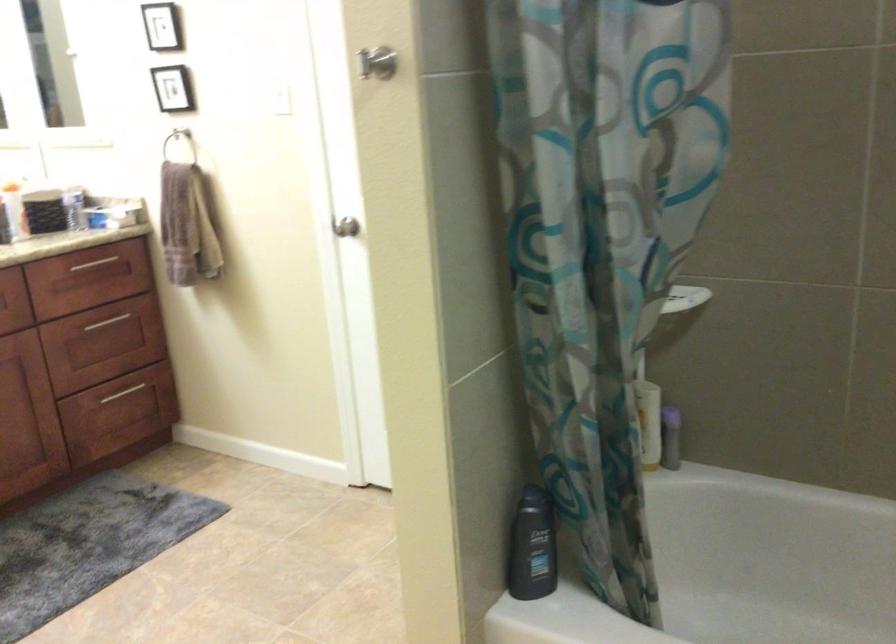
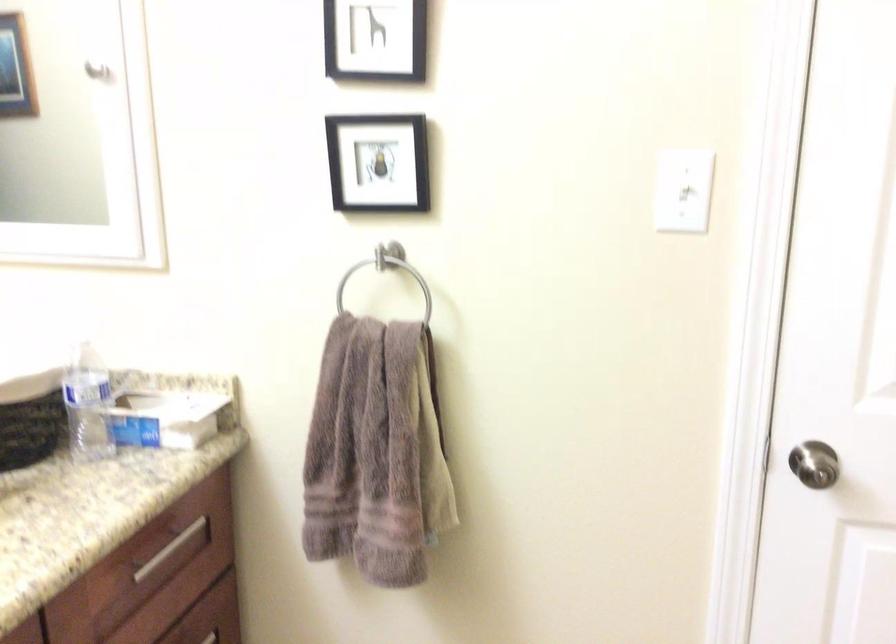
Locate, in the second image, the point that corresponds to (110,207) in the first image.

(165, 418)